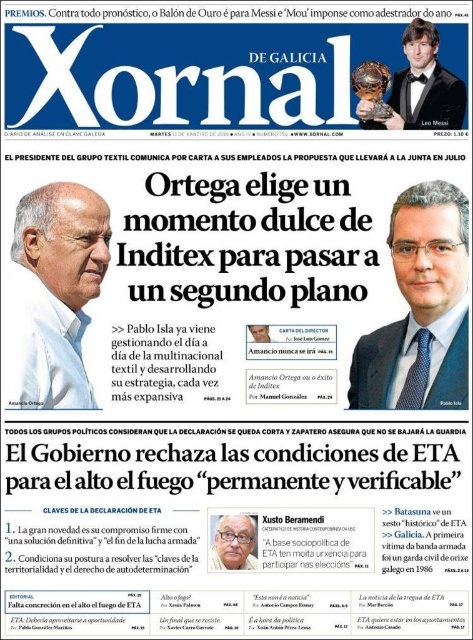
Who is positioned more to the left, matte black suit at right or white matte face at upper left?

white matte face at upper left

Is point (411, 296) closer to viewer compared to point (70, 385)?

That is False.

Describe the element at coordinates (420, 308) in the screenshot. Image resolution: width=473 pixels, height=640 pixels. I see `matte black suit at right` at that location.

Find the location of `matte black suit at right`. matte black suit at right is located at coordinates (420, 308).

Which is more to the left, matte black suit at right or gray hair at center?

Positioned to the left is gray hair at center.

Consider the image. Measure the distance between point (429, 340) and camera.

The distance of point (429, 340) from camera is 50.13 meters.

Where is `matte black suit at right`? The width and height of the screenshot is (473, 640). matte black suit at right is located at coordinates (420, 308).

Can you confirm if white matte face at upper left is shorter than black tuxedo at upper right?

No, white matte face at upper left is not shorter than black tuxedo at upper right.

How much distance is there between white matte face at upper left and black tuxedo at upper right?

white matte face at upper left and black tuxedo at upper right are 24.45 meters apart from each other.

Is point (43, 353) positioned after point (404, 104)?

That is False.

I want to click on white matte face at upper left, so click(x=52, y=294).